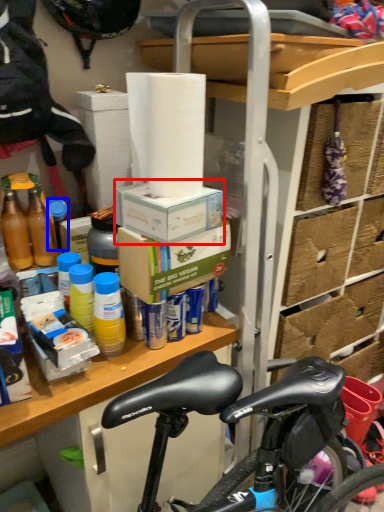
Question: Among these objects, which one is nearest to the camera, box (highlighted by a red box) or bottle (highlighted by a blue box)?

Choices:
 (A) box
 (B) bottle

Answer: (A)